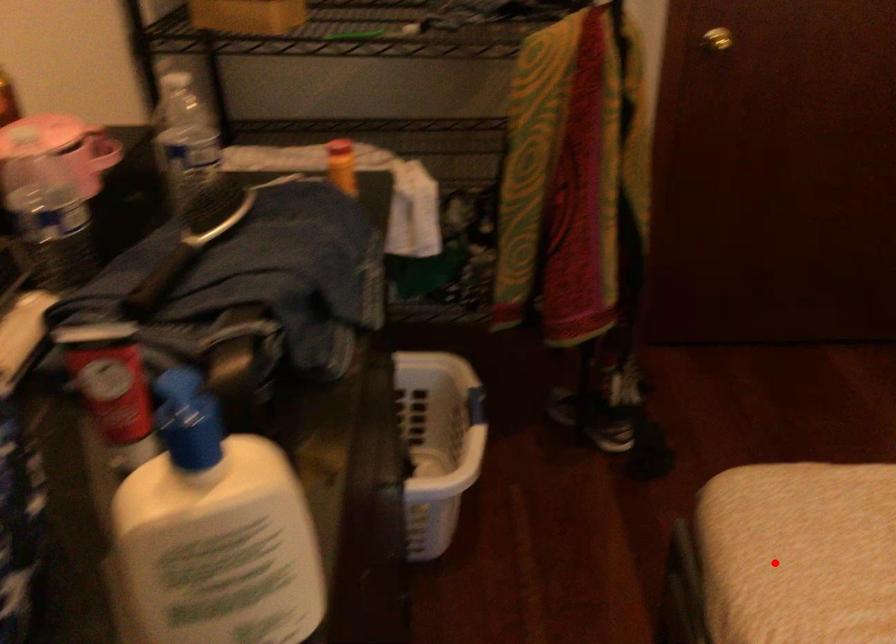
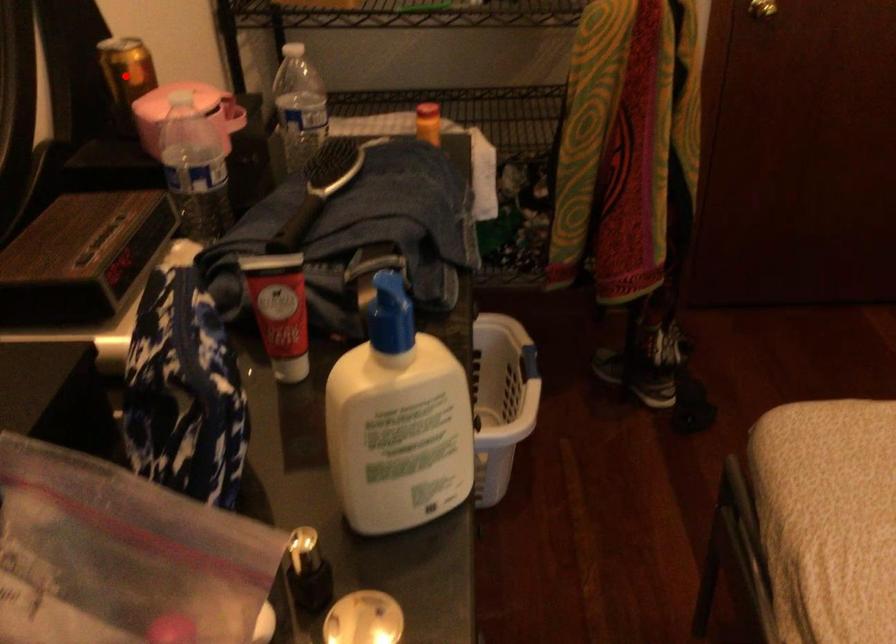
I am providing you with two images of the same scene from different viewpoints. A red point is marked on the first image and another point is marked on the second image. Is the red point in image1 aligned with the point shown in image2?

No